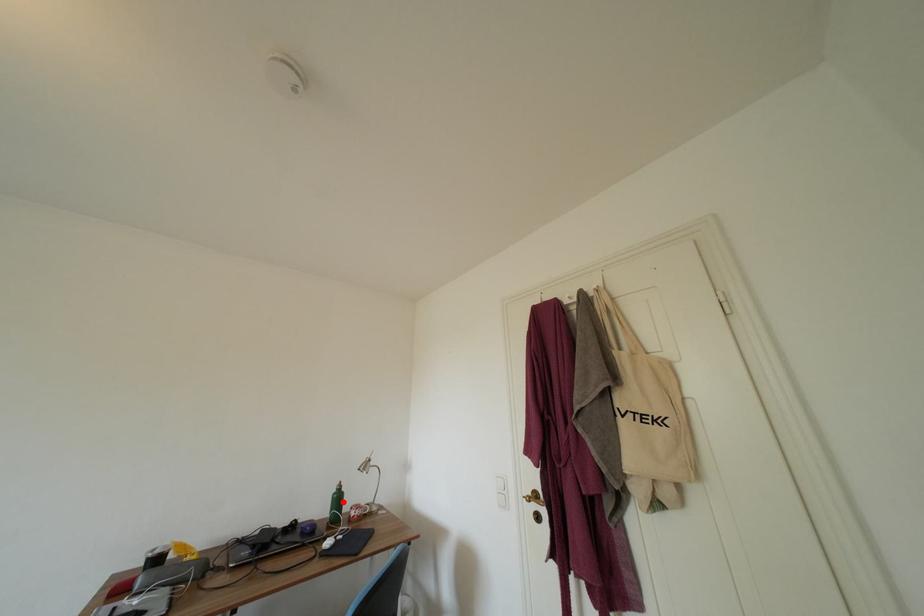
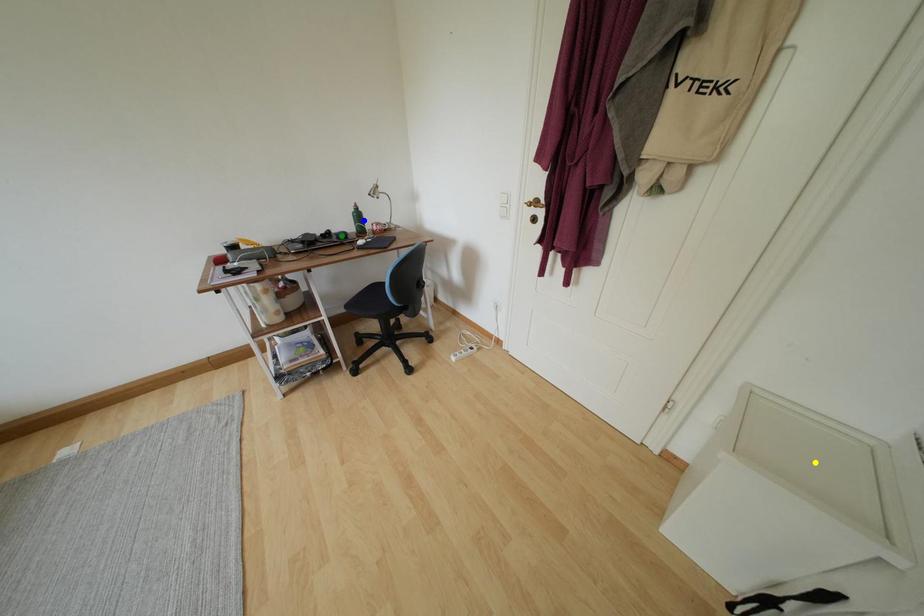
Question: I am providing you with two images of the same scene from different viewpoints. A red point is marked on the first image. You are given multiple points on the second image. In image 2, which mark is for the same physical point as the one in image 1?

Choices:
 (A) green point
 (B) blue point
 (C) yellow point

Answer: (B)